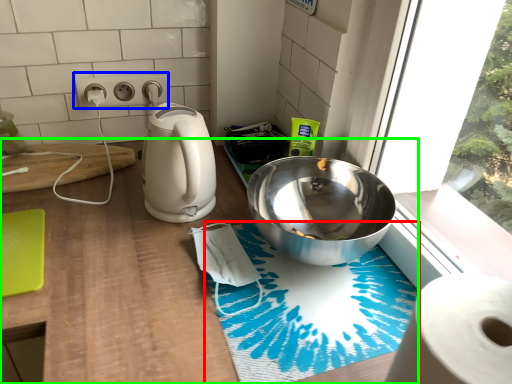
Question: Estimate the real-world distances between objects in this image. Which object is farther from bath mat (highlighted by a red box), electric outlet (highlighted by a blue box) or counter (highlighted by a green box)?

Choices:
 (A) electric outlet
 (B) counter

Answer: (A)